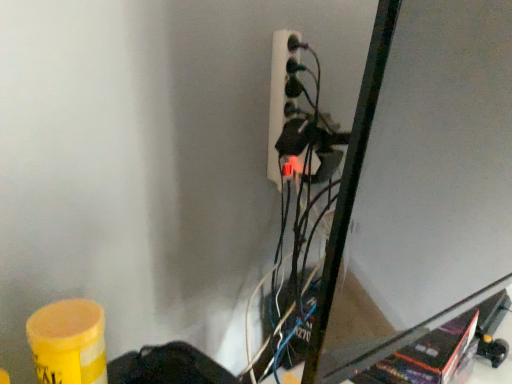
This screenshot has width=512, height=384. Describe the element at coordinates (278, 97) in the screenshot. I see `white plastic power plugs and sockets at upper center` at that location.

Where is `white plastic power plugs and sockets at upper center`? The width and height of the screenshot is (512, 384). white plastic power plugs and sockets at upper center is located at coordinates (278, 97).

Measure the distance between white plastic power plugs and sockets at upper center and camera.

white plastic power plugs and sockets at upper center is 33.65 inches from camera.

This screenshot has width=512, height=384. In order to click on yellow matte barrel at lower left in this screenshot , I will do `click(68, 342)`.

Describe the element at coordinates (68, 342) in the screenshot. The height and width of the screenshot is (384, 512). I see `yellow matte barrel at lower left` at that location.

Where is `white plastic power plugs and sockets at upper center`? white plastic power plugs and sockets at upper center is located at coordinates (278, 97).

Which is more to the left, yellow matte barrel at lower left or white plastic power plugs and sockets at upper center?

yellow matte barrel at lower left is more to the left.

Looking at this image, is the depth of yellow matte barrel at lower left greater than that of white plastic power plugs and sockets at upper center?

That is False.

Between point (47, 342) and point (280, 119), which one is positioned behind?

Point (280, 119)

From the image's perspective, is yellow matte barrel at lower left below white plastic power plugs and sockets at upper center?

Yes.

From a real-world perspective, is yellow matte barrel at lower left under white plastic power plugs and sockets at upper center?

Correct, in the physical world, yellow matte barrel at lower left is lower than white plastic power plugs and sockets at upper center.

Is yellow matte barrel at lower left wider than white plastic power plugs and sockets at upper center?

Correct, the width of yellow matte barrel at lower left exceeds that of white plastic power plugs and sockets at upper center.

Which of these two, yellow matte barrel at lower left or white plastic power plugs and sockets at upper center, stands taller?

white plastic power plugs and sockets at upper center is taller.

Looking at this image, considering the relative sizes of yellow matte barrel at lower left and white plastic power plugs and sockets at upper center in the image provided, is yellow matte barrel at lower left smaller than white plastic power plugs and sockets at upper center?

Yes.

Would you say white plastic power plugs and sockets at upper center is part of yellow matte barrel at lower left's contents?

Actually, white plastic power plugs and sockets at upper center is outside yellow matte barrel at lower left.

Is yellow matte barrel at lower left far from white plastic power plugs and sockets at upper center?

That's not correct — yellow matte barrel at lower left is a little close to white plastic power plugs and sockets at upper center.

Does yellow matte barrel at lower left turn towards white plastic power plugs and sockets at upper center?

No, yellow matte barrel at lower left is not facing towards white plastic power plugs and sockets at upper center.

In the image, there is a yellow matte barrel at lower left. In order to click on power plugs and sockets above it (from the image's perspective) in this screenshot , I will do `click(278, 97)`.

Is white plastic power plugs and sockets at upper center to the left of yellow matte barrel at lower left from the viewer's perspective?

No, white plastic power plugs and sockets at upper center is not to the left of yellow matte barrel at lower left.

Which is behind, white plastic power plugs and sockets at upper center or yellow matte barrel at lower left?

Positioned behind is white plastic power plugs and sockets at upper center.

Is point (276, 169) closer to viewer compared to point (63, 314)?

That is False.

From the image's perspective, which one is positioned higher, white plastic power plugs and sockets at upper center or yellow matte barrel at lower left?

white plastic power plugs and sockets at upper center, from the image's perspective.

Looking at this image, from a real-world perspective, does white plastic power plugs and sockets at upper center stand above yellow matte barrel at lower left?

Yes, from a real-world perspective, white plastic power plugs and sockets at upper center is over yellow matte barrel at lower left

Which object is thinner, white plastic power plugs and sockets at upper center or yellow matte barrel at lower left?

white plastic power plugs and sockets at upper center.

Considering the sizes of objects white plastic power plugs and sockets at upper center and yellow matte barrel at lower left in the image provided, who is taller, white plastic power plugs and sockets at upper center or yellow matte barrel at lower left?

With more height is white plastic power plugs and sockets at upper center.

Does white plastic power plugs and sockets at upper center have a smaller size compared to yellow matte barrel at lower left?

No, white plastic power plugs and sockets at upper center is not smaller than yellow matte barrel at lower left.

Is white plastic power plugs and sockets at upper center inside or outside of yellow matte barrel at lower left?

white plastic power plugs and sockets at upper center is spatially situated outside yellow matte barrel at lower left.

Based on the photo, would you consider white plastic power plugs and sockets at upper center to be distant from yellow matte barrel at lower left?

No, white plastic power plugs and sockets at upper center is not far from yellow matte barrel at lower left.

Is white plastic power plugs and sockets at upper center facing away from yellow matte barrel at lower left?

No, white plastic power plugs and sockets at upper center is not facing away from yellow matte barrel at lower left.

Locate an element on the screen. barrel on the left of the white plastic power plugs and sockets at upper center is located at coordinates (68, 342).

Locate an element on the screen. This screenshot has height=384, width=512. barrel lying in front of the white plastic power plugs and sockets at upper center is located at coordinates pos(68,342).

Where is `power plugs and sockets behind the yellow matte barrel at lower left`? power plugs and sockets behind the yellow matte barrel at lower left is located at coordinates (278, 97).